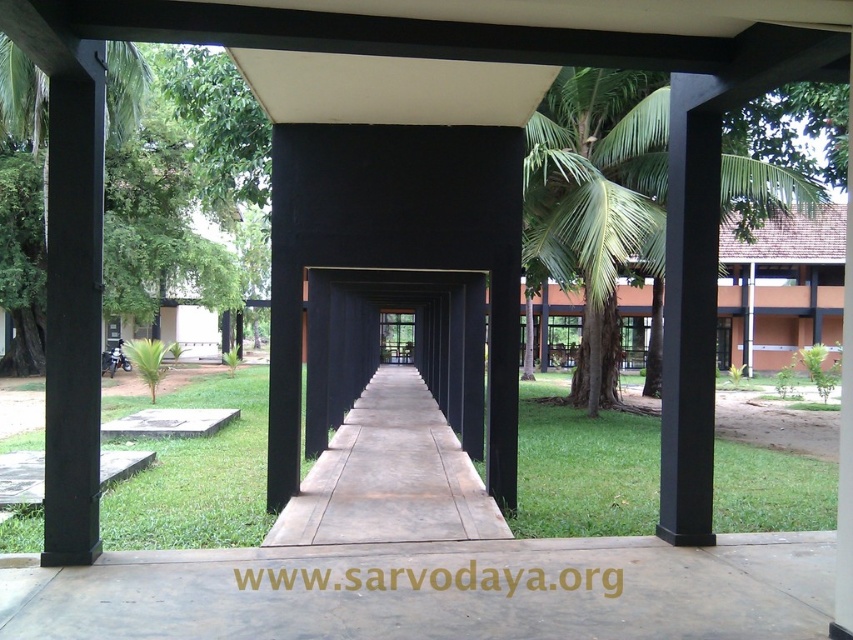
Question: Does green leafy tree at left have a larger size compared to black matte pillar at left?

Choices:
 (A) yes
 (B) no

Answer: (A)

Question: Which point appears closest to the camera in this image?

Choices:
 (A) (503, 528)
 (B) (32, 184)
 (C) (204, 440)

Answer: (A)

Question: Is the position of black matte pillar at left more distant than that of cement/path at center?

Choices:
 (A) no
 (B) yes

Answer: (A)

Question: Which object is the farthest from the green leafy palm tree at upper right?

Choices:
 (A) black matte pillar at left
 (B) green leafy tree at left
 (C) green grass at center
 (D) cement/path at center

Answer: (A)

Question: Which point appears farthest from the camera in this image?

Choices:
 (A) (566, 477)
 (B) (65, 211)
 (C) (10, 262)
 (D) (393, 508)

Answer: (C)

Question: Is green leafy tree at left behind black matte pillar at left?

Choices:
 (A) yes
 (B) no

Answer: (A)